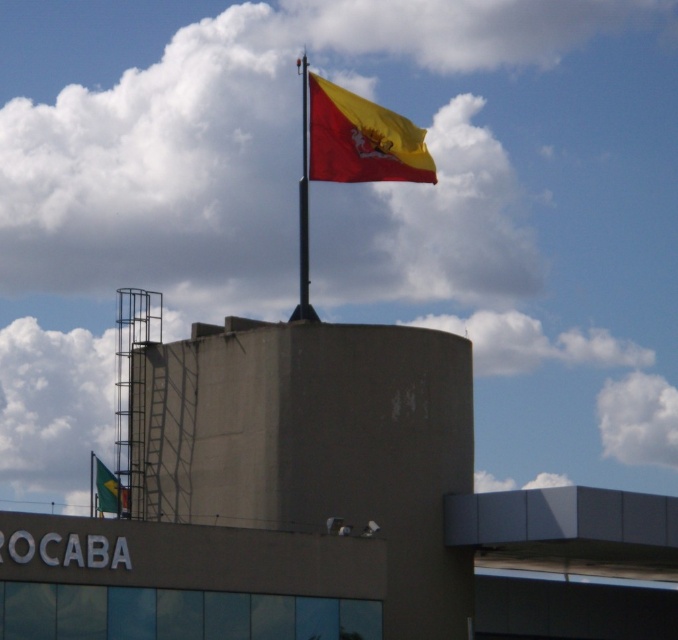
Question: Is polished metal flag pole at upper center to the right of green fabric flag at lower left from the viewer's perspective?

Choices:
 (A) yes
 (B) no

Answer: (A)

Question: Can you confirm if polished metal flag pole at upper center is positioned above metallic flag pole at upper center?

Choices:
 (A) yes
 (B) no

Answer: (A)

Question: Which of the following is the farthest from the observer?

Choices:
 (A) green fabric flag at lower left
 (B) polished metal flag pole at upper center
 (C) yellow matte flag at upper center

Answer: (A)

Question: Estimate the real-world distances between objects in this image. Which object is farther from the yellow matte flag at upper center?

Choices:
 (A) polished metal flag pole at upper center
 (B) green fabric flag at lower left

Answer: (A)

Question: Can you confirm if yellow matte flag at upper center is wider than metallic flag pole at upper center?

Choices:
 (A) yes
 (B) no

Answer: (A)

Question: Which point appears farthest from the camera in this image?

Choices:
 (A) (298, 61)
 (B) (119, 508)
 (C) (380, 179)

Answer: (A)